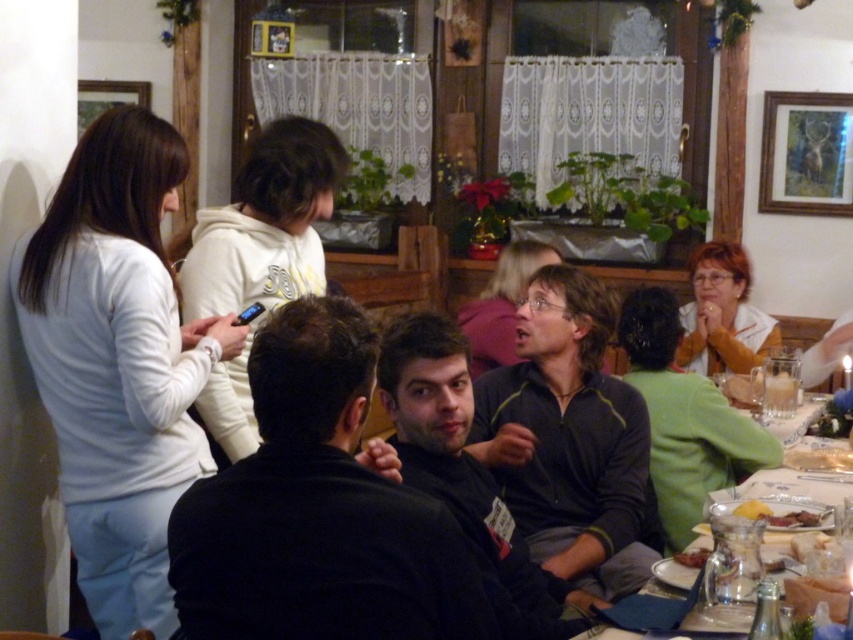
You are a photographer at the event and need to capture a photo of both the white fleece hoodie at upper left and the yellow matte plate at lower right in the same frame. Considering their sizes, which object should you focus on to ensure both fit clearly in the photo?

Since the white fleece hoodie at upper left is larger than the yellow matte plate at lower right, you should focus on the white fleece hoodie at upper left to ensure both objects fit clearly in the photo.

You are a server at the restaurant and need to deliver a drink to the person wearing the white fleece hoodie at upper left. There is a yellow matte plate at lower right in the way. Can you reach the person without moving the plate?

The yellow matte plate at lower right is behind the white fleece hoodie at upper left, so you can reach the person wearing the white fleece hoodie at upper left without moving the plate since it is not blocking the path.